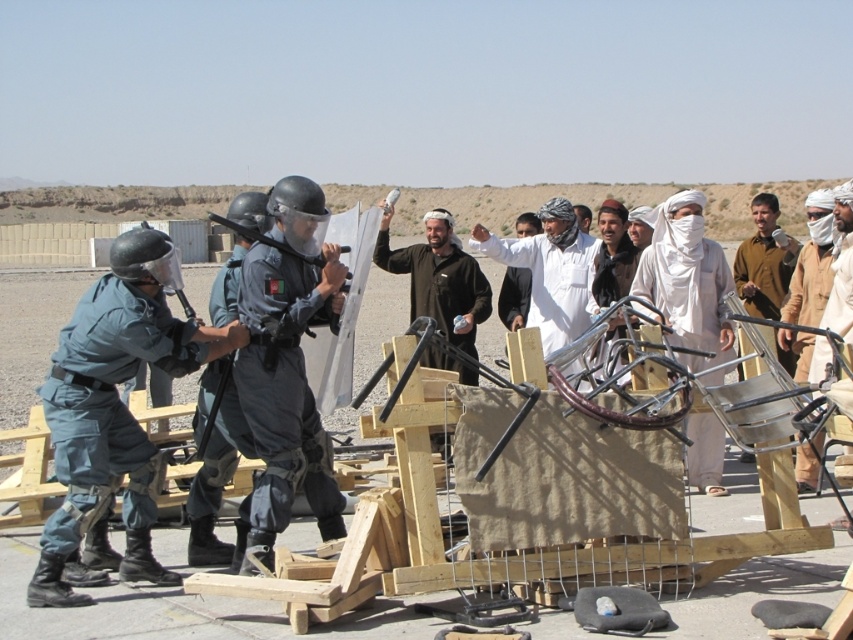
Consider the image. You are a drone operator trying to capture the scene from above. You need to determine which of the two points, point (402, 518) or point (708, 444), is closer to your camera position. Based on the description, which point is closer?

Point (402, 518) is closer to the camera than point (708, 444).

Looking at this image, you are a participant in the training exercise and need to identify which fabric item is taller between the light brown fabric at center and the brown fabric turban at center. Which one is taller?

The brown fabric turban at center is taller than the light brown fabric at center.

You are a safety inspector checking the training area. You notice the wooden frame at center and the white cotton turban at center. Is there any safety concern regarding their current positions?

Yes, the wooden frame at center is positioned over white cotton turban at center, which could pose a safety hazard if the frame were to fall or shift during the exercise.